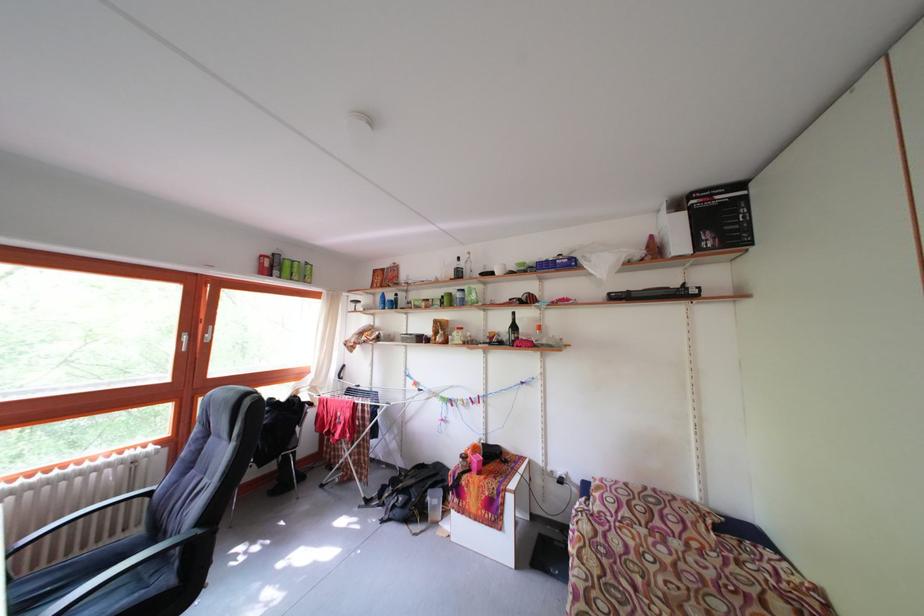
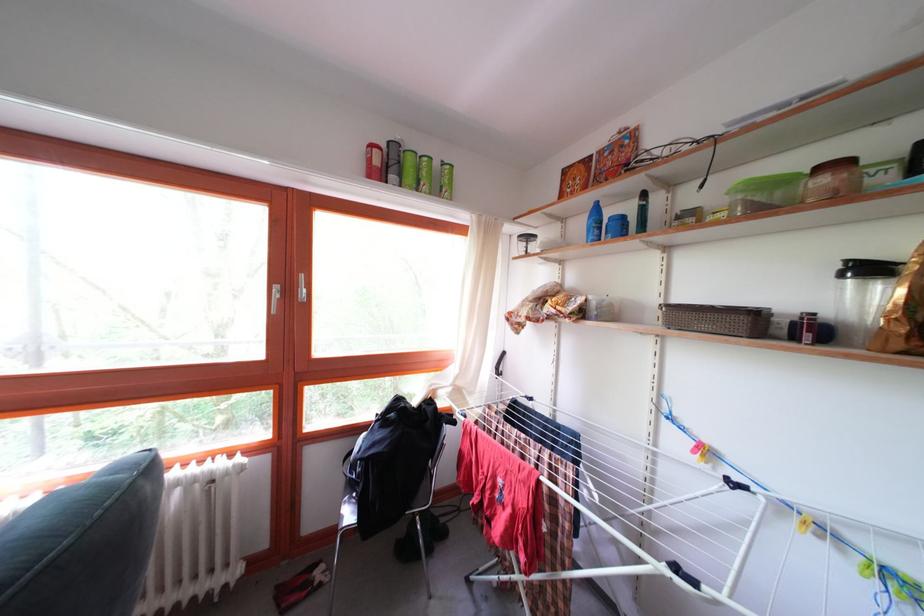
Question: I am providing you with two images of the same scene from different viewpoints. Please identify which objects are invisible in image2.

Choices:
 (A) blue spray bottle
 (B) red cylindrical can
 (C) clear plastic container
 (D) none of these

Answer: (D)